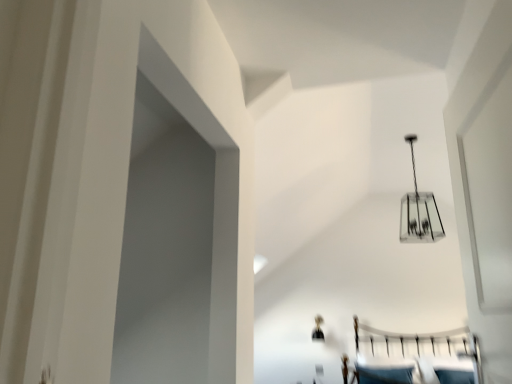
Question: Looking at the image, does clear glass chandelier at upper center, the first lamp from the bottom, seem bigger or smaller compared to clear glass chandelier at upper center, arranged as the 1th lamp when viewed from the front?

Choices:
 (A) small
 (B) big

Answer: (A)

Question: From their relative heights in the image, would you say clear glass chandelier at upper center, which appears as the first lamp when viewed from the left, is taller or shorter than clear glass chandelier at upper center, marked as the first lamp in a right-to-left arrangement?

Choices:
 (A) short
 (B) tall

Answer: (A)

Question: Does point (318, 329) appear closer or farther from the camera than point (437, 220)?

Choices:
 (A) closer
 (B) farther

Answer: (A)

Question: From the image's perspective, is clear glass chandelier at upper center, arranged as the 1th lamp when viewed from the front, positioned above or below clear glass chandelier at upper center, which ranks as the second lamp in top-to-bottom order?

Choices:
 (A) above
 (B) below

Answer: (A)

Question: Is point (430, 208) positioned closer to the camera than point (315, 331)?

Choices:
 (A) farther
 (B) closer

Answer: (A)

Question: Looking at their shapes, would you say clear glass chandelier at upper center, which appears as the second lamp when viewed from the left, is wider or thinner than clear glass chandelier at upper center, which appears as the first lamp when viewed from the left?

Choices:
 (A) wide
 (B) thin

Answer: (A)

Question: Do you think clear glass chandelier at upper center, which appears as the second lamp when viewed from the left, is within clear glass chandelier at upper center, the first lamp from the bottom, or outside of it?

Choices:
 (A) outside
 (B) inside

Answer: (A)